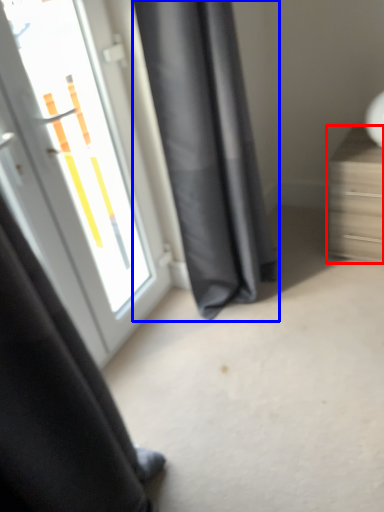
Question: Among these objects, which one is farthest to the camera, furniture (highlighted by a red box) or curtain (highlighted by a blue box)?

Choices:
 (A) furniture
 (B) curtain

Answer: (A)